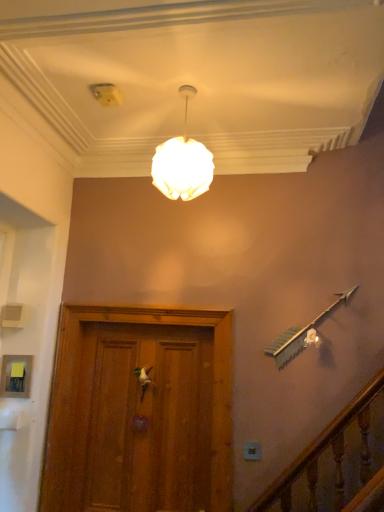
Locate an element on the screen. This screenshot has width=384, height=512. white matte sphere at upper center is located at coordinates (182, 162).

Measure the distance between point (x=257, y=444) and camera.

The depth of point (x=257, y=444) is 7.46 feet.

What do you see at coordinates (252, 451) in the screenshot? The height and width of the screenshot is (512, 384). I see `white plastic electric outlet at lower center` at bounding box center [252, 451].

The height and width of the screenshot is (512, 384). I want to click on white matte door handle at center, so click(143, 379).

From a real-world perspective, which object stands above the other?

white matte sphere at upper center.

From the image's perspective, would you say white matte sphere at upper center is shown under white plastic electric outlet at lower center?

No, from the image's perspective, white matte sphere at upper center is not below white plastic electric outlet at lower center.

Where is `lamp on the left side of white plastic electric outlet at lower center`? lamp on the left side of white plastic electric outlet at lower center is located at coordinates (182, 162).

Is white matte sphere at upper center beside white plastic electric outlet at lower center?

No, white matte sphere at upper center is not making contact with white plastic electric outlet at lower center.

Based on the photo, is white plastic electric outlet at lower center in front of white matte sphere at upper center?

No, white plastic electric outlet at lower center is further to the viewer.

The width and height of the screenshot is (384, 512). What are the coordinates of `electric outlet lying behind the white matte sphere at upper center` in the screenshot? It's located at (252, 451).

Is white plastic electric outlet at lower center thinner than white matte sphere at upper center?

Correct, the width of white plastic electric outlet at lower center is less than that of white matte sphere at upper center.

Considering the relative positions of white plastic electric outlet at lower center and white matte sphere at upper center in the image provided, is white plastic electric outlet at lower center to the left or to the right of white matte sphere at upper center?

Based on their positions, white plastic electric outlet at lower center is located to the right of white matte sphere at upper center.

Are white matte door handle at center and white matte sphere at upper center making contact?

No, white matte door handle at center is not beside white matte sphere at upper center.

Considering the sizes of white matte door handle at center and white matte sphere at upper center in the image, is white matte door handle at center wider or thinner than white matte sphere at upper center?

white matte door handle at center is thinner than white matte sphere at upper center.

How far apart are white matte door handle at center and white matte sphere at upper center?

white matte door handle at center is 1.24 meters away from white matte sphere at upper center.

Is white matte door handle at center oriented away from white matte sphere at upper center?

No, white matte door handle at center's orientation is not away from white matte sphere at upper center.

Consider the image. Based on their sizes in the image, would you say white matte sphere at upper center is bigger or smaller than white matte door handle at center?

Clearly, white matte sphere at upper center is larger in size than white matte door handle at center.

Which is behind, white matte sphere at upper center or white matte door handle at center?

white matte door handle at center.

Considering the relative positions of white matte sphere at upper center and white matte door handle at center in the image provided, is white matte sphere at upper center to the left of white matte door handle at center from the viewer's perspective?

Incorrect, white matte sphere at upper center is not on the left side of white matte door handle at center.

Is white plastic electric outlet at lower center to the left of white matte door handle at center from the viewer's perspective?

No.

Is white plastic electric outlet at lower center facing away from white matte door handle at center?

white plastic electric outlet at lower center does not have its back to white matte door handle at center.

Are white plastic electric outlet at lower center and white matte door handle at center far apart?

No, there isn't a large distance between white plastic electric outlet at lower center and white matte door handle at center.

Locate an element on the screen. door handle behind the white plastic electric outlet at lower center is located at coordinates (143, 379).

Is white matte door handle at center not close to white plastic electric outlet at lower center?

That's not correct — white matte door handle at center is a little close to white plastic electric outlet at lower center.

Is white matte door handle at center inside or outside of white plastic electric outlet at lower center?

white matte door handle at center cannot be found inside white plastic electric outlet at lower center.

Does white matte door handle at center have a lesser width compared to white plastic electric outlet at lower center?

No, white matte door handle at center is not thinner than white plastic electric outlet at lower center.

Where is `electric outlet that is behind the white matte sphere at upper center`? Image resolution: width=384 pixels, height=512 pixels. electric outlet that is behind the white matte sphere at upper center is located at coordinates (252, 451).

I want to click on lamp above the white plastic electric outlet at lower center (from the image's perspective), so click(x=182, y=162).

Consider the image. Considering their positions, is white matte sphere at upper center positioned further to white plastic electric outlet at lower center than white matte door handle at center?

white matte sphere at upper center is positioned further to the anchor white plastic electric outlet at lower center.

From the image, which object appears to be farther from white matte sphere at upper center, white matte door handle at center or white plastic electric outlet at lower center?

white plastic electric outlet at lower center.

When comparing their distances from white plastic electric outlet at lower center, does white matte door handle at center or white matte sphere at upper center seem closer?

white matte door handle at center.

From the image, which object appears to be farther from white matte door handle at center, white plastic electric outlet at lower center or white matte sphere at upper center?

Based on the image, white matte sphere at upper center appears to be further to white matte door handle at center.

Considering their positions, is white plastic electric outlet at lower center positioned further to white matte sphere at upper center than white matte door handle at center?

The object further to white matte sphere at upper center is white plastic electric outlet at lower center.

When comparing their distances from white matte door handle at center, does white matte sphere at upper center or white plastic electric outlet at lower center seem closer?

white plastic electric outlet at lower center is closer to white matte door handle at center.

I want to click on door handle between white matte sphere at upper center and white plastic electric outlet at lower center in the up-down direction, so click(143, 379).